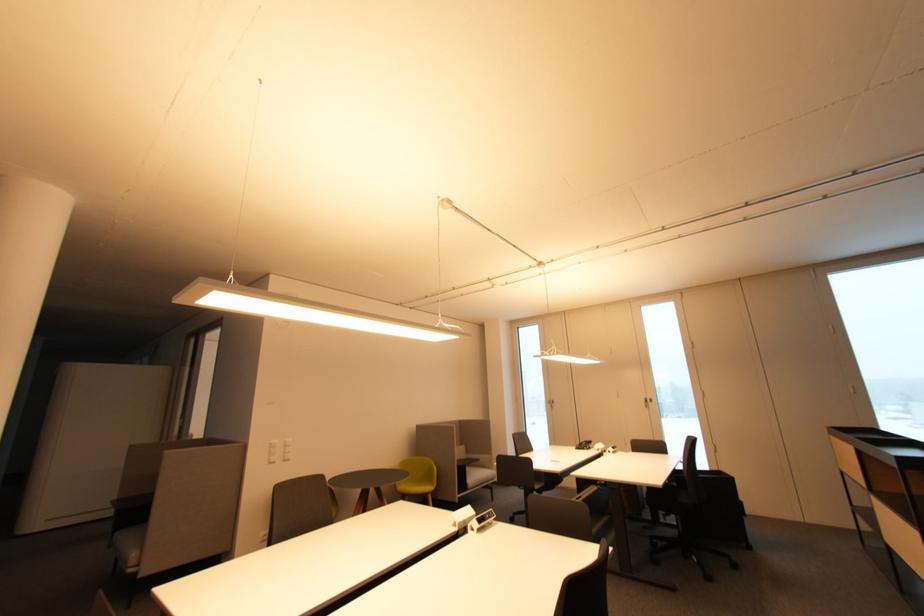
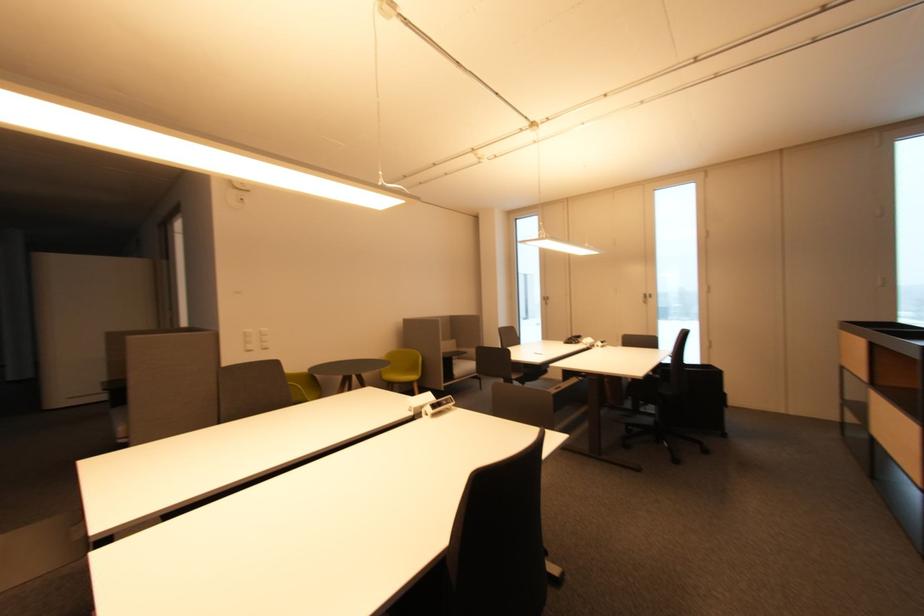
Question: Based on the continuous images, in which direction is the camera rotating? Reply with the corresponding letter.

Choices:
 (A) Left
 (B) Right
 (C) Up
 (D) Down

Answer: (D)